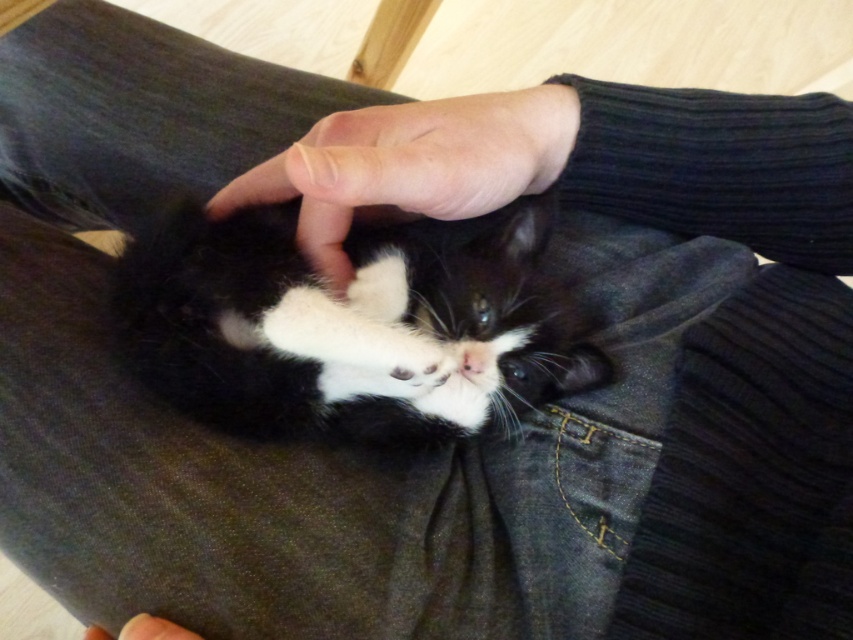
You are a robotic petting assistant. You need to place your robotic hand at the exact position where the smooth skin hand at center is currently touching the kitten. What are the coordinates of the position where you should place your robotic hand?

The coordinates for the smooth skin hand at center are at point [410,164]. You should place your robotic hand at those coordinates to mimic the exact position.

You are a photographer adjusting your camera to focus on two points in the image. The first point is point (474,99) and the second point is point (550,416). Which point should you focus on first if you want to capture the closest object in the scene?

Point (474,99) is closer to the viewer than point (550,416), so you should focus on point (474,99) first to capture the closest object in the scene.

You are a veterinarian examining the image of a kitten on someone lap. You see a smooth skin hand at center and a smooth skin at center. Which one has a larger surface area?

The smooth skin hand at center has a larger surface area than the smooth skin at center.